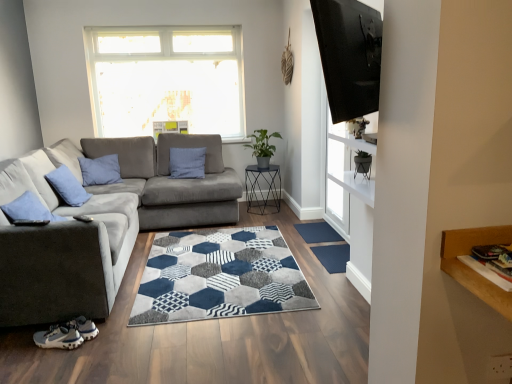
Question: Considering the positions of point (327, 251) and point (82, 190), is point (327, 251) closer or farther from the camera than point (82, 190)?

Choices:
 (A) closer
 (B) farther

Answer: (A)

Question: Looking at the image, does blue textured doormat at center, the first doormat ordered from the bottom, seem bigger or smaller compared to velvet blue pillow at left?

Choices:
 (A) small
 (B) big

Answer: (A)

Question: Based on their relative distances, which object is farther from the blue textured doormat at center, the first doormat ordered from the bottom?

Choices:
 (A) velvet blue pillow at left
 (B) metallic hexagonal table at center
 (C) transparent glass door at upper right
 (D) black matte plant pot at upper center
 (E) blue rubber doormat at center, the 1th doormat viewed from the top

Answer: (A)

Question: Which object is the closest to the transparent glass door at upper right?

Choices:
 (A) velvet blue pillow at left
 (B) blue rubber doormat at center, arranged as the first doormat when viewed from the back
 (C) blue textured doormat at center, which is the 2th doormat in back-to-front order
 (D) black glossy tv at upper right
 (E) black matte plant pot at upper center

Answer: (B)